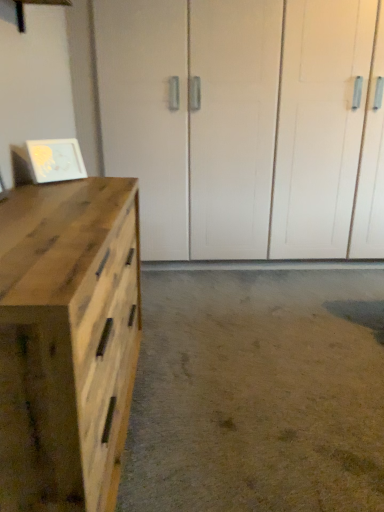
The image size is (384, 512). Describe the element at coordinates (66, 341) in the screenshot. I see `natural wood dresser at left` at that location.

This screenshot has height=512, width=384. Identify the location of natural wood dresser at left. (66, 341).

At what (x,y) coordinates should I click in order to perform the action: click on natural wood dresser at left. Please return your answer as a coordinate pair (x, y). The width and height of the screenshot is (384, 512). Looking at the image, I should click on (66, 341).